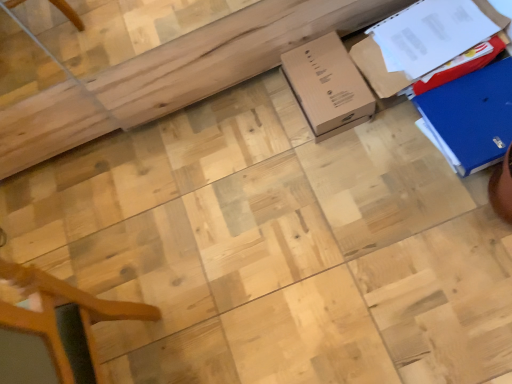
Question: Is point (373, 52) closer or farther from the camera than point (426, 92)?

Choices:
 (A) closer
 (B) farther

Answer: (B)

Question: Considering the positions of brown cardboard box at upper right, the second cardboard box in the right-to-left sequence, and blue cardboard box at right, the third cardboard box viewed from the left, in the image, is brown cardboard box at upper right, the second cardboard box in the right-to-left sequence, taller or shorter than blue cardboard box at right, the third cardboard box viewed from the left,?

Choices:
 (A) short
 (B) tall

Answer: (B)

Question: Which is nearer to the blue cardboard box at right, which is the first cardboard box from right to left?

Choices:
 (A) brown cardboard box at center, which appears as the 3th cardboard box when viewed from the right
 (B) brown cardboard box at upper right, the second cardboard box in the right-to-left sequence

Answer: (B)

Question: Based on their relative distances, which object is nearer to the brown cardboard box at center, which appears as the 3th cardboard box when viewed from the right?

Choices:
 (A) blue cardboard box at right, which is the first cardboard box from right to left
 (B) brown cardboard box at upper right, the second cardboard box in the right-to-left sequence

Answer: (B)